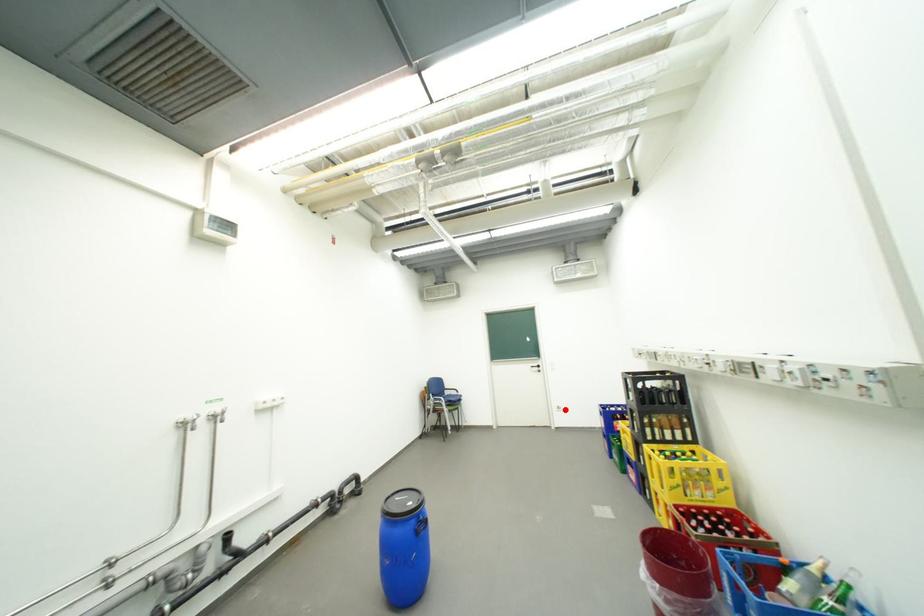
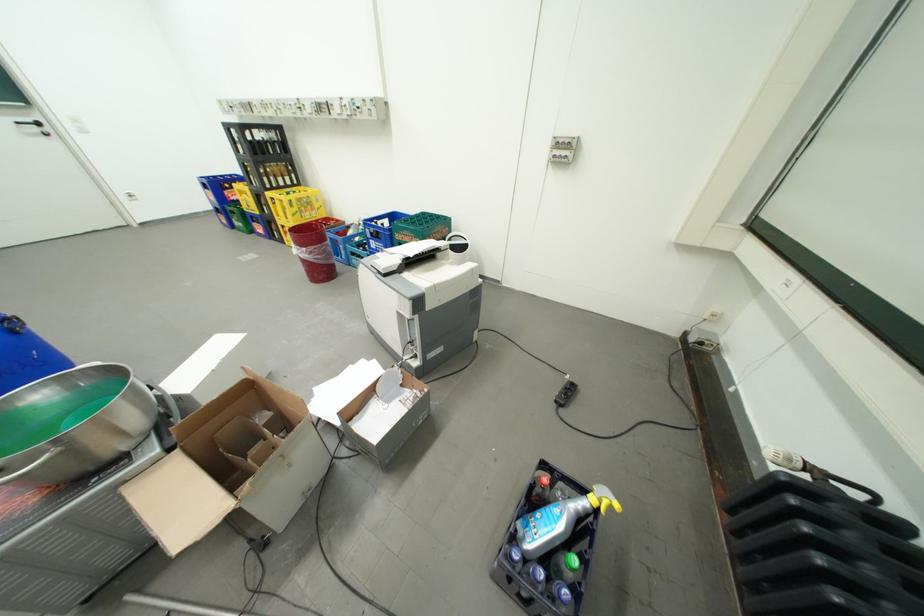
Find the pixel in the second image that matches the highlighted location in the first image.

(134, 199)